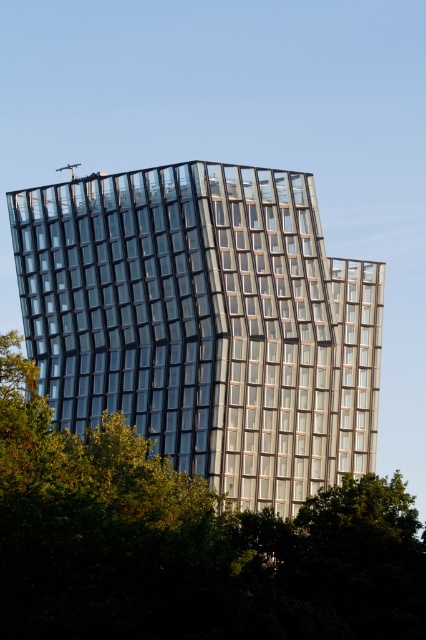
Does point (111, 193) lie in front of point (37, 522)?

No, it is not.

Is point (167, 314) farther from camera compared to point (368, 618)?

Yes, point (167, 314) is behind point (368, 618).

Identify the location of glassy metallic building at center. (204, 323).